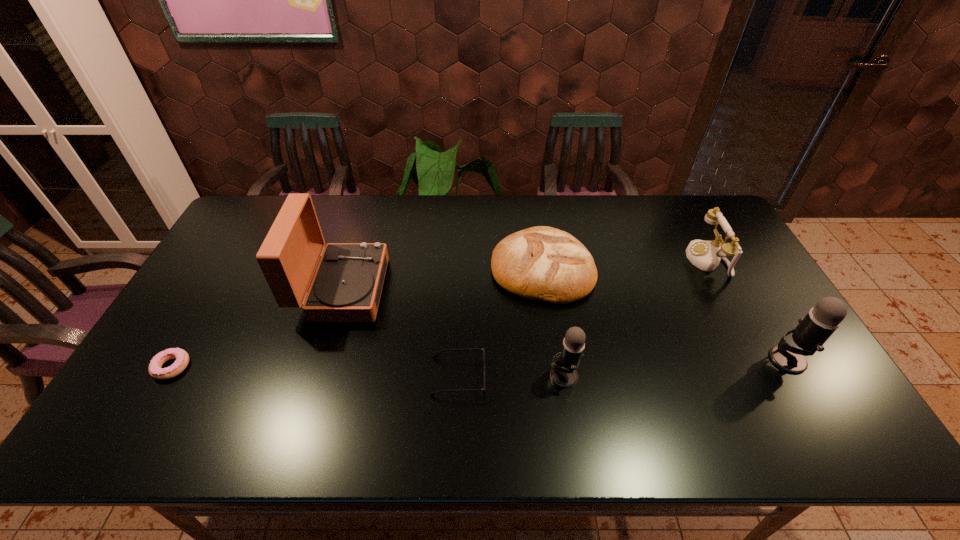
The width and height of the screenshot is (960, 540). I want to click on vacant space positioned 0.150m on the right of the left microphone, so click(x=637, y=375).

You are a GUI agent. You are given a task and a screenshot of the screen. Output one action in this format:
    pyautogui.click(x=<x>, y=<y>)
    Task: Click on the free space located on the back of the right microphone
    
    Given the screenshot: What is the action you would take?
    pyautogui.click(x=756, y=307)

Where is `free region located on the dial of the telephone`? free region located on the dial of the telephone is located at coordinates (647, 260).

Where is `vacant space located on the dial of the telephone`? The width and height of the screenshot is (960, 540). vacant space located on the dial of the telephone is located at coordinates (611, 260).

Where is `free space located on the dial of the telephone`? The height and width of the screenshot is (540, 960). free space located on the dial of the telephone is located at coordinates (x=619, y=260).

Locate an element on the screen. vacant area located 0.210m on the face of the sixth object from right to left is located at coordinates (453, 289).

At what (x,y) coordinates should I click in order to perform the action: click on free spot located on the front of the bread. Please return your answer as a coordinate pair (x, y). Looking at the image, I should click on (555, 352).

Identify the location of free spot located 0.200m on the back of the leftmost object. (212, 296).

The image size is (960, 540). Find the location of `vacant space located 0.280m on the front-facing side of the second shortest object`. vacant space located 0.280m on the front-facing side of the second shortest object is located at coordinates (596, 376).

Where is `doughnut at the near edge`? Image resolution: width=960 pixels, height=540 pixels. doughnut at the near edge is located at coordinates (182, 358).